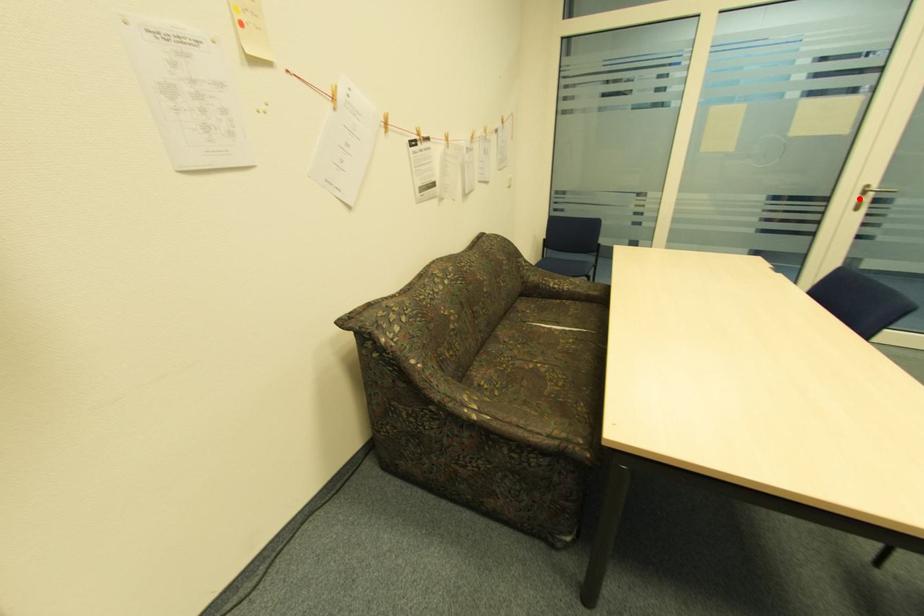
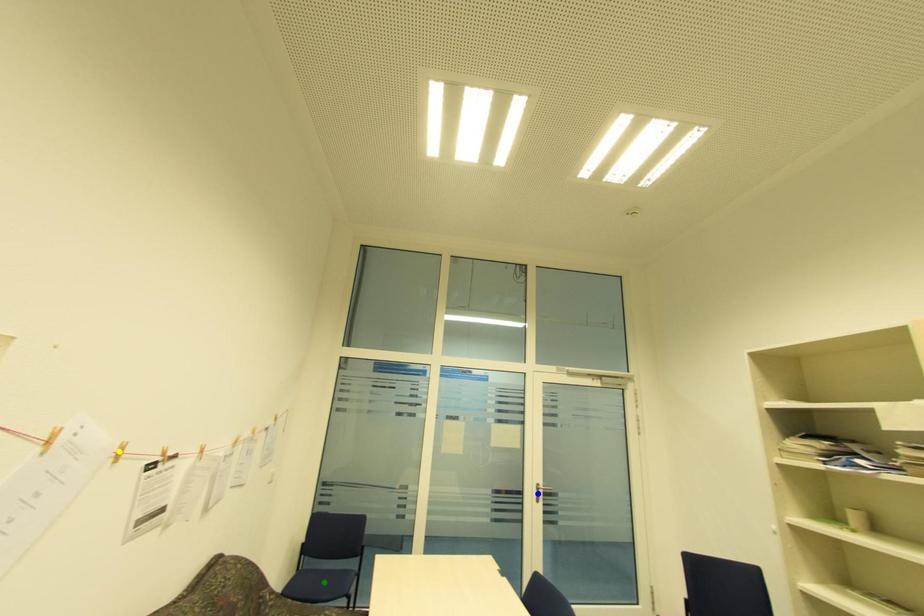
Question: I am providing you with two images of the same scene from different viewpoints. A red point is marked on the first image. You are given multiple points on the second image. Which mark in image 2 goes with the point in image 1?

Choices:
 (A) green point
 (B) blue point
 (C) yellow point

Answer: (B)